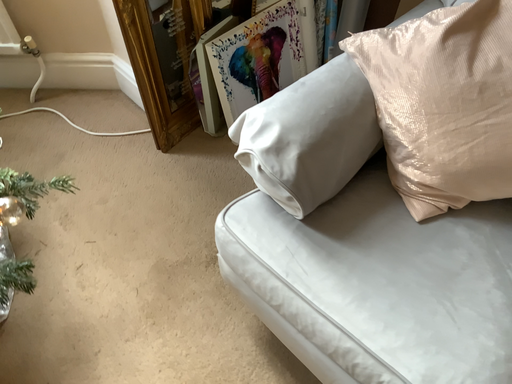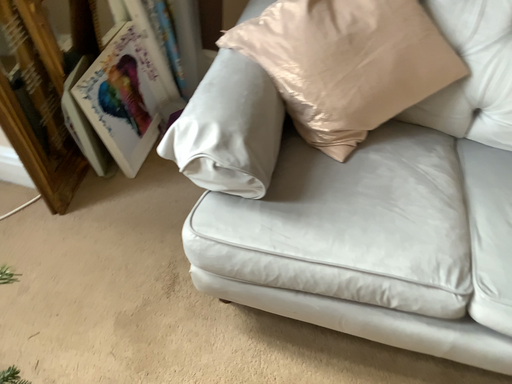
Question: Which way did the camera rotate in the video?

Choices:
 (A) rotated right
 (B) rotated left

Answer: (A)